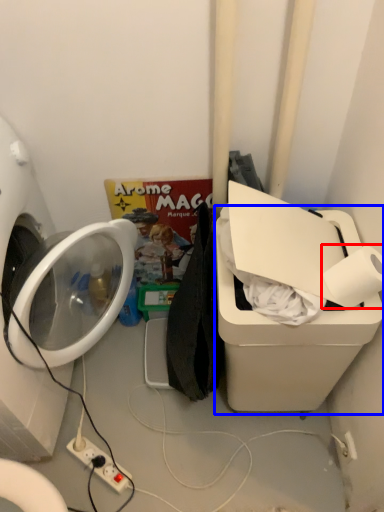
Question: Which object appears farthest to the camera in this image, toilet paper (highlighted by a red box) or water cooler (highlighted by a blue box)?

Choices:
 (A) toilet paper
 (B) water cooler

Answer: (A)